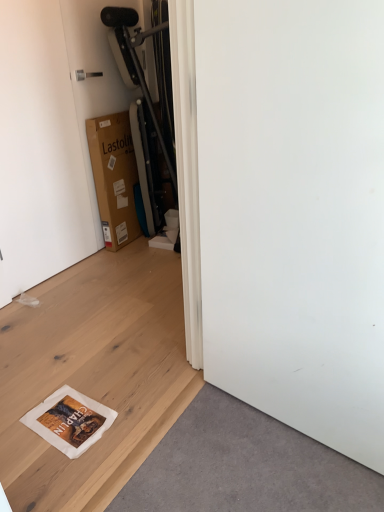
At what (x,y) coordinates should I click in order to perform the action: click on free space in front of white matte door at upper left. Please return your answer as a coordinate pair (x, y). The height and width of the screenshot is (512, 384). Looking at the image, I should click on (53, 302).